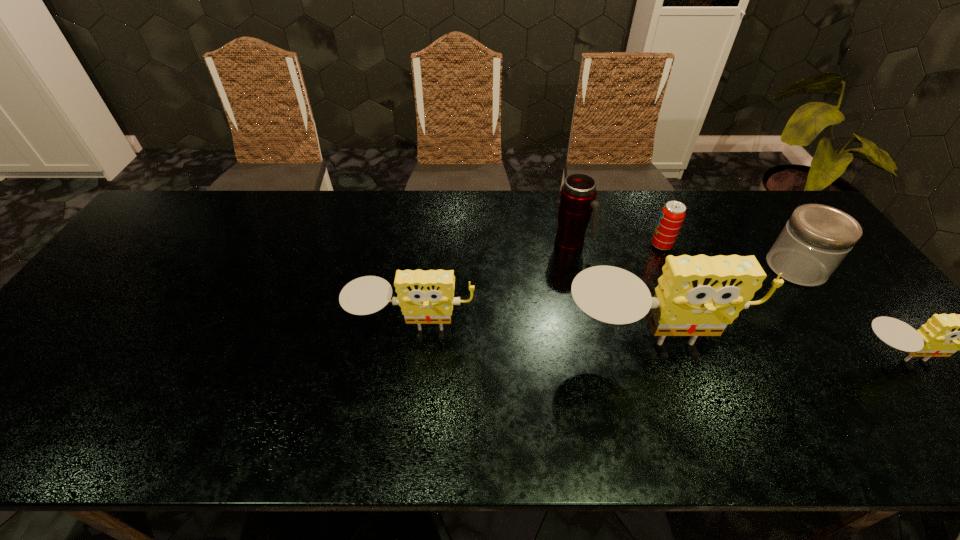
The width and height of the screenshot is (960, 540). Identify the location of the leftmost sponge. (426, 297).

Where is `the second tallest sponge`? The height and width of the screenshot is (540, 960). the second tallest sponge is located at coordinates (426, 297).

At what (x,y) coordinates should I click in order to perform the action: click on the tallest sponge. Please return your answer as a coordinate pair (x, y). Looking at the image, I should click on (699, 295).

The width and height of the screenshot is (960, 540). I want to click on the second sponge from left to right, so click(x=699, y=295).

At what (x,y) coordinates should I click in order to perform the action: click on soda can. Please return your answer as a coordinate pair (x, y). The width and height of the screenshot is (960, 540). Looking at the image, I should click on (671, 218).

At what (x,y) coordinates should I click in order to perform the action: click on jar. Please return your answer as a coordinate pair (x, y). The height and width of the screenshot is (540, 960). Looking at the image, I should click on (815, 240).

Locate an element on the screen. thermos bottle is located at coordinates (577, 199).

Identify the location of free region located on the front-facing side of the second shortest sponge. This screenshot has height=540, width=960. (406, 388).

I want to click on free space located on the front-facing side of the second sponge from left to right, so click(668, 404).

Where is `vacant area situated 0.340m on the right of the soda can`? The image size is (960, 540). vacant area situated 0.340m on the right of the soda can is located at coordinates (783, 245).